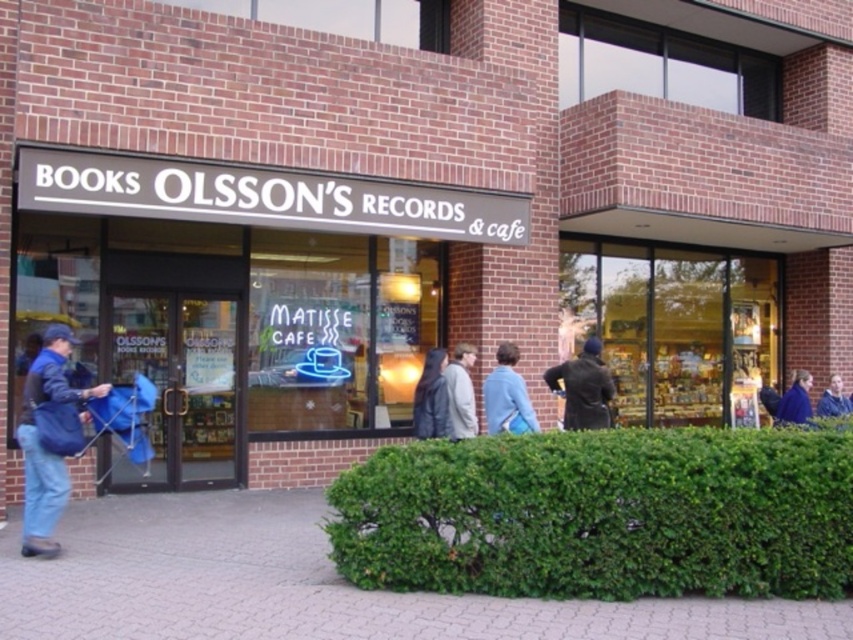
Is brick pavement at lower center wider than matte black sign at center?

Incorrect, brick pavement at lower center's width does not surpass matte black sign at center's.

Can you confirm if brick pavement at lower center is smaller than matte black sign at center?

Correct, brick pavement at lower center occupies less space than matte black sign at center.

Does point (84, 589) come farther from viewer compared to point (344, 188)?

No.

Find the location of a particular element. The width and height of the screenshot is (853, 640). brick pavement at lower center is located at coordinates (310, 586).

Where is `dark brown leather coat at center`? The width and height of the screenshot is (853, 640). dark brown leather coat at center is located at coordinates (583, 387).

Can you confirm if dark brown leather coat at center is taller than blue denim jacket at upper right?

Yes, dark brown leather coat at center is taller than blue denim jacket at upper right.

Which is behind, point (572, 380) or point (840, 400)?

The point (840, 400) is more distant.

The width and height of the screenshot is (853, 640). Find the location of `dark brown leather coat at center`. dark brown leather coat at center is located at coordinates (583, 387).

Describe the element at coordinates (602, 513) in the screenshot. This screenshot has width=853, height=640. I see `green leafy hedge at lower center` at that location.

Find the location of a particular element. The image size is (853, 640). green leafy hedge at lower center is located at coordinates (602, 513).

Find the location of a particular element. green leafy hedge at lower center is located at coordinates (602, 513).